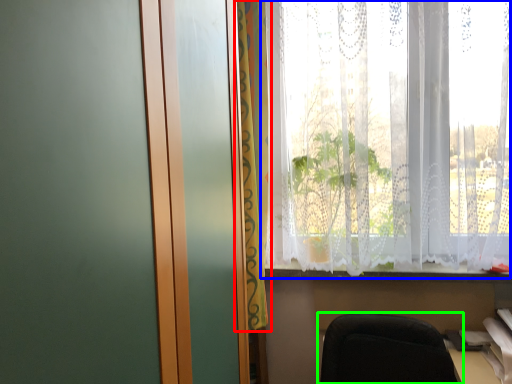
Question: Which object is the farthest from curtain (highlighted by a red box)? Choose among these: window (highlighted by a blue box) or chair (highlighted by a green box).

Choices:
 (A) window
 (B) chair

Answer: (B)